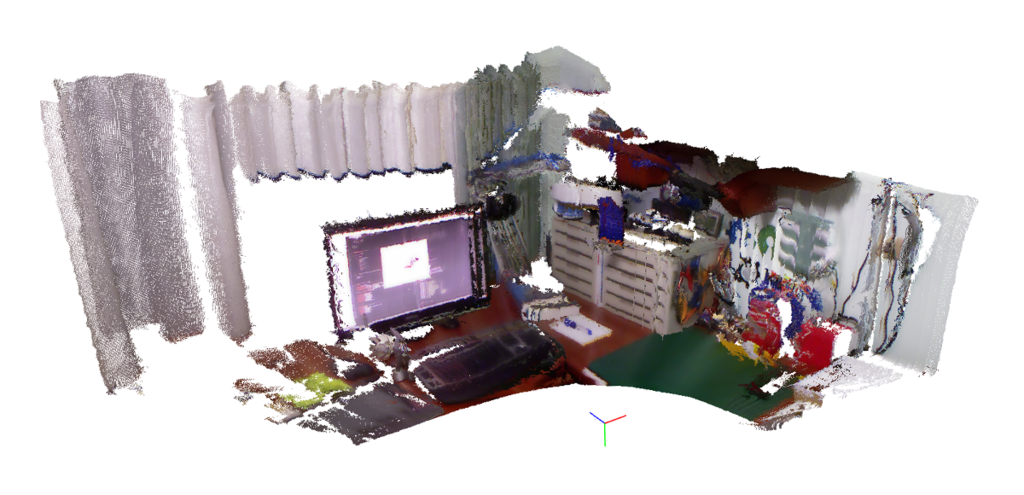
Locate an element on the screen. This screenshot has height=495, width=1024. brown computer desk is located at coordinates (631, 331), (587, 352), (477, 319), (445, 408).